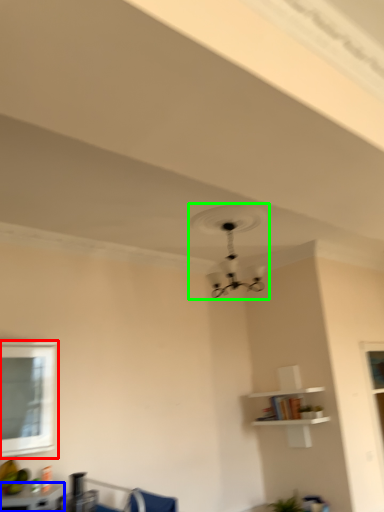
Question: Which is nearer to the window (highlighted by a red box)? table (highlighted by a blue box) or fan (highlighted by a green box).

Choices:
 (A) table
 (B) fan

Answer: (A)